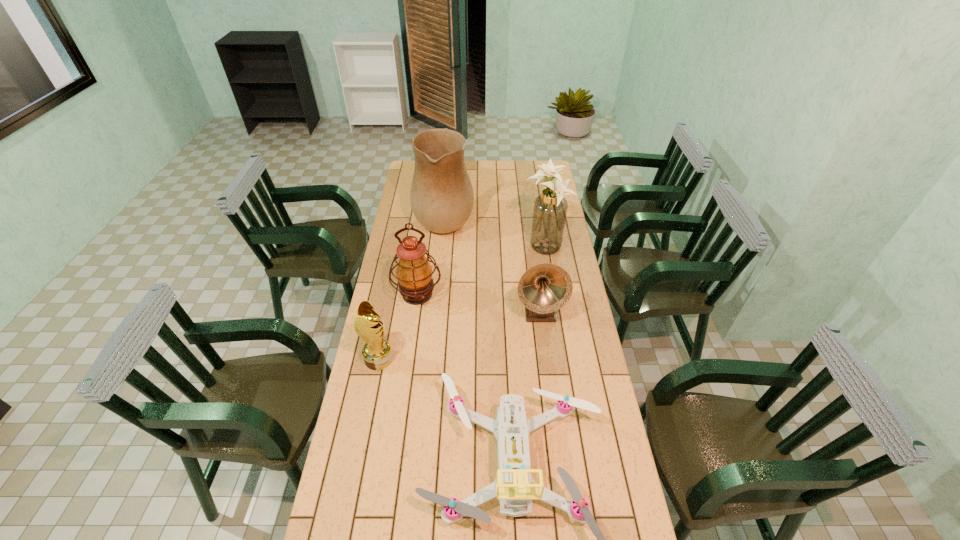
Where is `free space between the second nearest object and the oil lamp`? free space between the second nearest object and the oil lamp is located at coordinates (398, 326).

Where is `free spot between the phonograph record and the oil lamp`? free spot between the phonograph record and the oil lamp is located at coordinates (478, 302).

I want to click on empty location between the oil lamp and the phonograph record, so click(478, 302).

Identify the location of object that is the fourth nearest to the nearest object. The image size is (960, 540). (550, 208).

Where is `object that can be found as the closest to the oil lamp`? The image size is (960, 540). object that can be found as the closest to the oil lamp is located at coordinates (377, 353).

The height and width of the screenshot is (540, 960). I want to click on free space that satisfies the following two spatial constraints: 1. on the front side of the oil lamp; 2. on the front-facing side of the award, so click(x=408, y=359).

I want to click on free location that satisfies the following two spatial constraints: 1. at the spout of the cream pitcher; 2. on the back side of the flower arrangement, so click(x=442, y=248).

Where is `free space that satisfies the following two spatial constraints: 1. at the spout of the cream pitcher; 2. on the front side of the oil lamp`? This screenshot has width=960, height=540. free space that satisfies the following two spatial constraints: 1. at the spout of the cream pitcher; 2. on the front side of the oil lamp is located at coordinates (437, 294).

Find the location of `free space that satisfies the following two spatial constraints: 1. at the spout of the cream pitcher; 2. on the right side of the flower arrangement`. free space that satisfies the following two spatial constraints: 1. at the spout of the cream pitcher; 2. on the right side of the flower arrangement is located at coordinates (442, 248).

Where is `vacant area that satisfies the following two spatial constraints: 1. on the back side of the flower arrangement; 2. at the spout of the cream pitcher`? The width and height of the screenshot is (960, 540). vacant area that satisfies the following two spatial constraints: 1. on the back side of the flower arrangement; 2. at the spout of the cream pitcher is located at coordinates (540, 217).